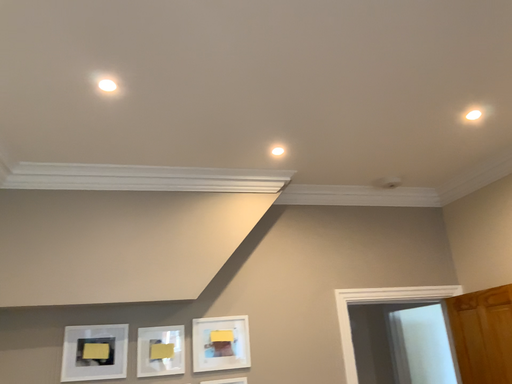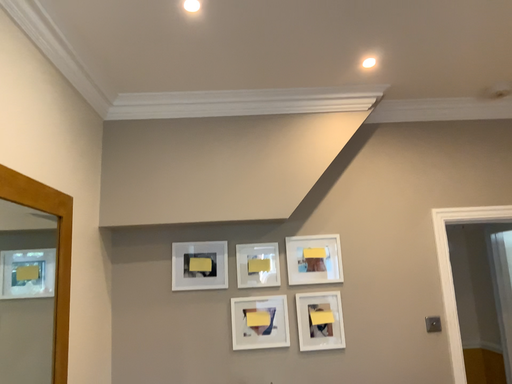
Question: Which way did the camera rotate in the video?

Choices:
 (A) rotated upward
 (B) rotated downward

Answer: (B)